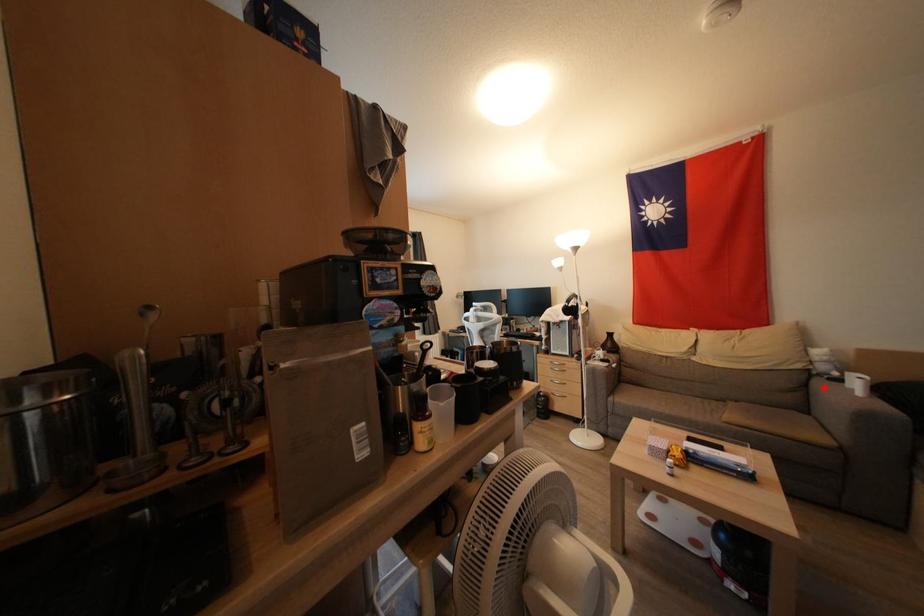
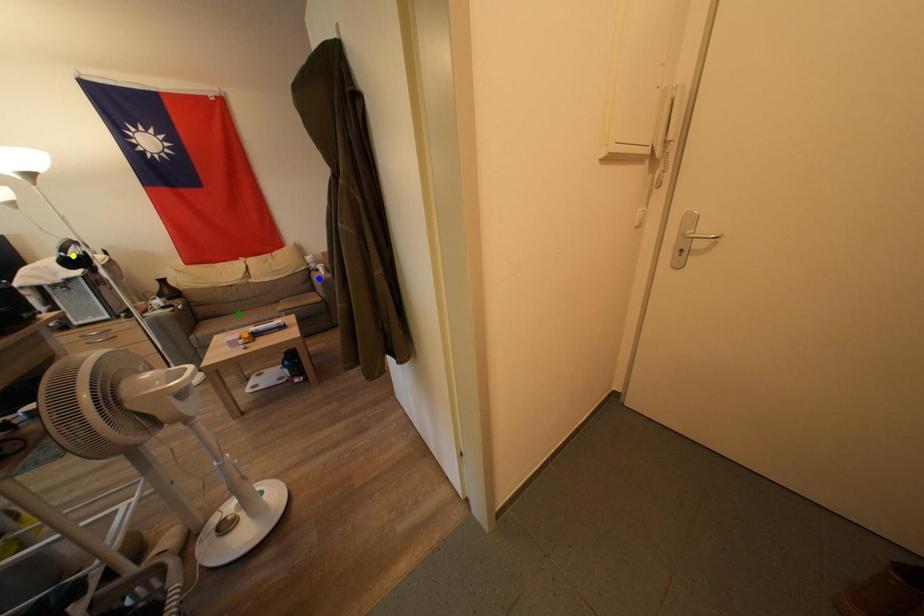
Question: I am providing you with two images of the same scene from different viewpoints. A red point is marked on the first image. You are given multiple points on the second image. Which mark in image 2 goes with the point in image 1?

Choices:
 (A) blue point
 (B) yellow point
 (C) green point

Answer: (A)